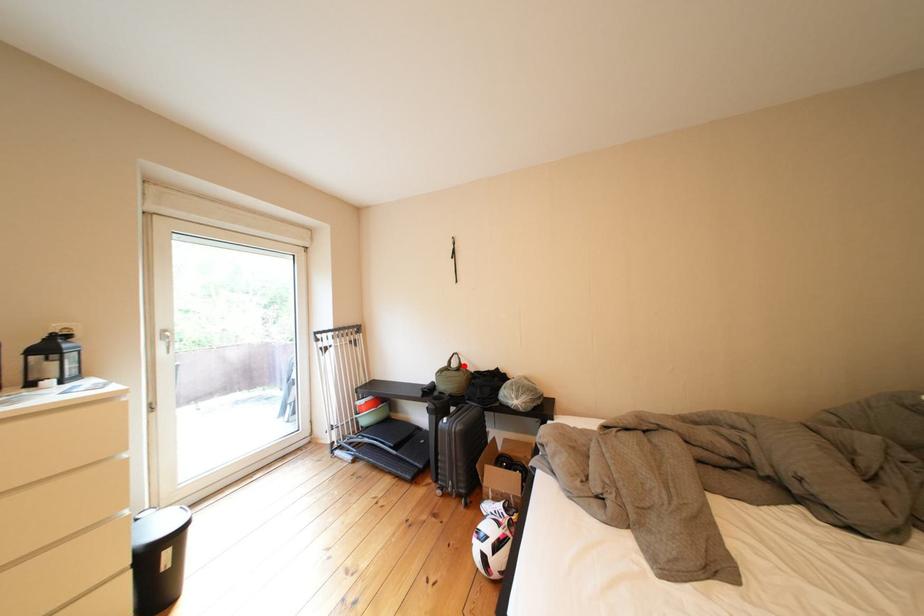
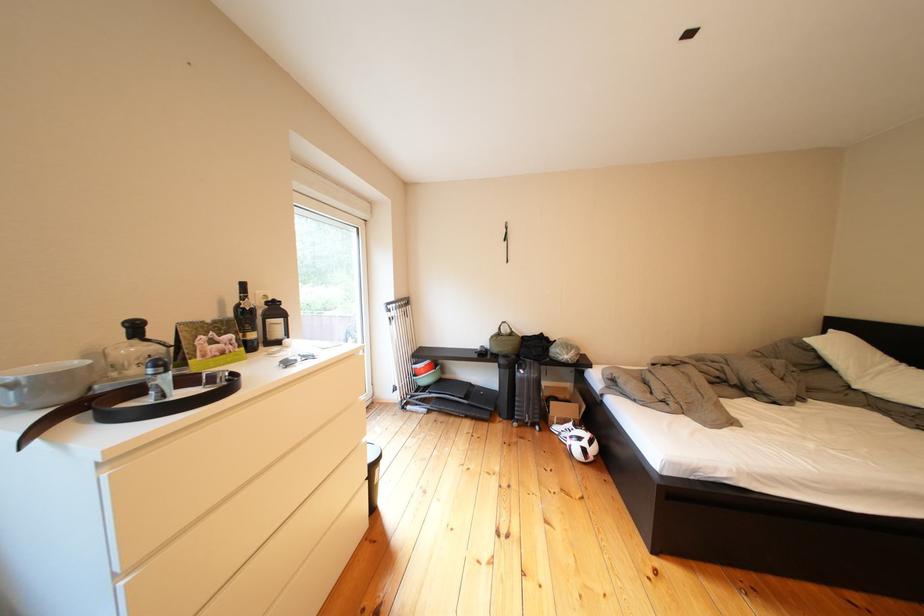
Where in the second image is the point corresponding to the highlighted location from the first image?

(514, 334)